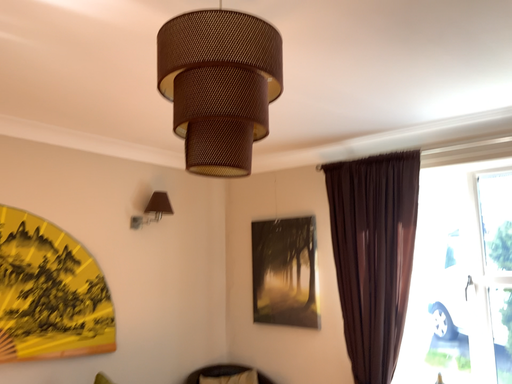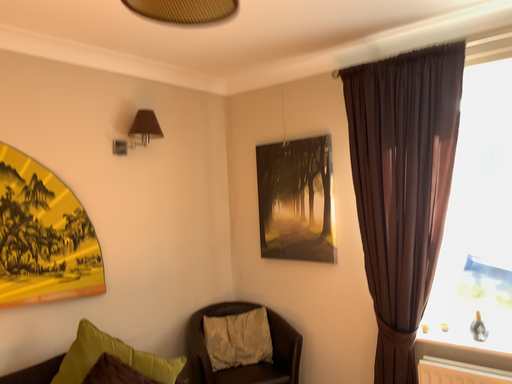
Question: How did the camera likely rotate when shooting the video?

Choices:
 (A) rotated upward
 (B) rotated downward

Answer: (B)